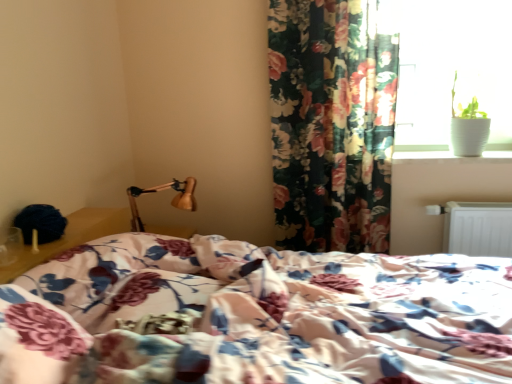
At what (x,y) coordinates should I click in order to perform the action: click on white ceramic pot at upper right. Please return your answer as a coordinate pair (x, y). Looking at the image, I should click on (450, 68).

Consider the image. From the image's perspective, relative to wooden lamp at upper left, is floral fabric bed at center above or below?

floral fabric bed at center is below wooden lamp at upper left.

Considering the sizes of floral fabric bed at center and wooden lamp at upper left in the image, is floral fabric bed at center wider or thinner than wooden lamp at upper left?

Considering their sizes, floral fabric bed at center looks broader than wooden lamp at upper left.

Could you tell me if floral fabric bed at center is facing wooden lamp at upper left?

No.

Who is smaller, white metallic radiator at lower right or white ceramic pot at upper right?

white metallic radiator at lower right is smaller.

Is white metallic radiator at lower right wider than white ceramic pot at upper right?

In fact, white metallic radiator at lower right might be narrower than white ceramic pot at upper right.

Considering the positions of objects white metallic radiator at lower right and white ceramic pot at upper right in the image provided, who is more to the right, white metallic radiator at lower right or white ceramic pot at upper right?

A: Positioned to the right is white metallic radiator at lower right.

From the image's perspective, which object appears higher, white metallic radiator at lower right or white ceramic pot at upper right?

white ceramic pot at upper right.

From a real-world perspective, is floral fabric bed at center located higher than floral fabric curtain at upper right?

Actually, floral fabric bed at center is physically below floral fabric curtain at upper right in the real world.

Between floral fabric bed at center and floral fabric curtain at upper right, which one appears on the right side from the viewer's perspective?

floral fabric curtain at upper right.

How different are the orientations of floral fabric bed at center and floral fabric curtain at upper right in degrees?

The angular difference between floral fabric bed at center and floral fabric curtain at upper right is 89.5 degrees.

Is floral fabric curtain at upper right surrounded by floral fabric bed at center?

Definitely not — floral fabric curtain at upper right is not inside floral fabric bed at center.

Which is in front, point (446, 161) or point (352, 91)?

The point (352, 91) is closer to the camera.

Where is `curtain in front of the white glossy window sill at upper right`? curtain in front of the white glossy window sill at upper right is located at coordinates (331, 124).

From a real-world perspective, is white glossy window sill at upper right positioned above or below floral fabric curtain at upper right?

From a real-world perspective, white glossy window sill at upper right is physically below floral fabric curtain at upper right.

Considering the relative sizes of white glossy window sill at upper right and floral fabric curtain at upper right in the image provided, is white glossy window sill at upper right smaller than floral fabric curtain at upper right?

Correct, white glossy window sill at upper right occupies less space than floral fabric curtain at upper right.

From a real-world perspective, is floral fabric bed at center positioned under white glossy window sill at upper right based on gravity?

Indeed, from a real-world perspective, floral fabric bed at center is positioned beneath white glossy window sill at upper right.

Could you tell me if floral fabric bed at center is turned towards white glossy window sill at upper right?

No, floral fabric bed at center does not turn towards white glossy window sill at upper right.

Is floral fabric bed at center bigger than white glossy window sill at upper right?

Yes.

Is floral fabric bed at center outside of white glossy window sill at upper right?

floral fabric bed at center lies outside white glossy window sill at upper right's area.

From the image's perspective, does white glossy window sill at upper right appear lower than wooden lamp at upper left?

Incorrect, from the image's perspective, white glossy window sill at upper right is higher than wooden lamp at upper left.

Which of these two, white glossy window sill at upper right or wooden lamp at upper left, is thinner?

white glossy window sill at upper right.

Considering the positions of objects white glossy window sill at upper right and wooden lamp at upper left in the image provided, who is behind, white glossy window sill at upper right or wooden lamp at upper left?

white glossy window sill at upper right is further from the camera.

Is white glossy window sill at upper right to the right of wooden lamp at upper left from the viewer's perspective?

Yes.

Does wooden lamp at upper left have a smaller size compared to white metallic radiator at lower right?

No.

Is wooden lamp at upper left thinner than white metallic radiator at lower right?

No, wooden lamp at upper left is not thinner than white metallic radiator at lower right.

Considering the positions of point (176, 198) and point (501, 226), is point (176, 198) closer or farther from the camera than point (501, 226)?

Clearly, point (176, 198) is more distant from the camera than point (501, 226).

Is wooden lamp at upper left turned away from white metallic radiator at lower right?

No, wooden lamp at upper left is not facing away from white metallic radiator at lower right.

You are a GUI agent. You are given a task and a screenshot of the screen. Output one action in this format:
    pyautogui.click(x=<x>, y=<y>)
    Task: Click on the bedside lamp positioned vertically above the floral fabric bed at center (from a real-world perspective)
    The image size is (512, 384).
    Given the screenshot: What is the action you would take?
    pyautogui.click(x=162, y=190)

Identify the location of radiator below the white ceramic pot at upper right (from a real-world perspective). The image size is (512, 384). (478, 228).

Which object lies further to the anchor point white metallic radiator at lower right, white ceramic pot at upper right or wooden lamp at upper left?

wooden lamp at upper left lies further to white metallic radiator at lower right than the other object.

Considering their positions, is white ceramic pot at upper right positioned further to floral fabric bed at center than white glossy window sill at upper right?

white ceramic pot at upper right is positioned further to the anchor floral fabric bed at center.

Based on their spatial positions, is white metallic radiator at lower right or wooden lamp at upper left closer to white ceramic pot at upper right?

The object closer to white ceramic pot at upper right is white metallic radiator at lower right.

Estimate the real-world distances between objects in this image. Which object is closer to wooden lamp at upper left, floral fabric curtain at upper right or white ceramic pot at upper right?

floral fabric curtain at upper right is closer to wooden lamp at upper left.

Based on their spatial positions, is white metallic radiator at lower right or wooden lamp at upper left further from floral fabric curtain at upper right?

Based on the image, wooden lamp at upper left appears to be further to floral fabric curtain at upper right.

From the image, which object appears to be nearer to white glossy window sill at upper right, floral fabric curtain at upper right or wooden lamp at upper left?

floral fabric curtain at upper right.

When comparing their distances from floral fabric bed at center, does floral fabric curtain at upper right or white ceramic pot at upper right seem closer?

floral fabric curtain at upper right is positioned closer to the anchor floral fabric bed at center.

Considering their positions, is white ceramic pot at upper right positioned closer to white glossy window sill at upper right than wooden lamp at upper left?

Among the two, white ceramic pot at upper right is located nearer to white glossy window sill at upper right.

Image resolution: width=512 pixels, height=384 pixels. I want to click on window sill situated between wooden lamp at upper left and white metallic radiator at lower right from left to right, so click(x=450, y=157).

Image resolution: width=512 pixels, height=384 pixels. In order to click on curtain between floral fabric bed at center and white ceramic pot at upper right along the z-axis in this screenshot , I will do `click(331, 124)`.

I want to click on window between wooden lamp at upper left and white metallic radiator at lower right in the horizontal direction, so click(x=450, y=68).

Locate an element on the screen. The image size is (512, 384). curtain between wooden lamp at upper left and white metallic radiator at lower right in the horizontal direction is located at coordinates (331, 124).